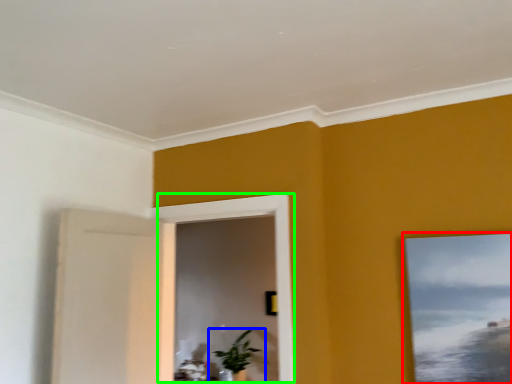
Question: Which object is positioned farthest from picture frame (highlighted by a red box)? Select from houseplant (highlighted by a blue box) and window (highlighted by a green box).

Choices:
 (A) houseplant
 (B) window

Answer: (A)